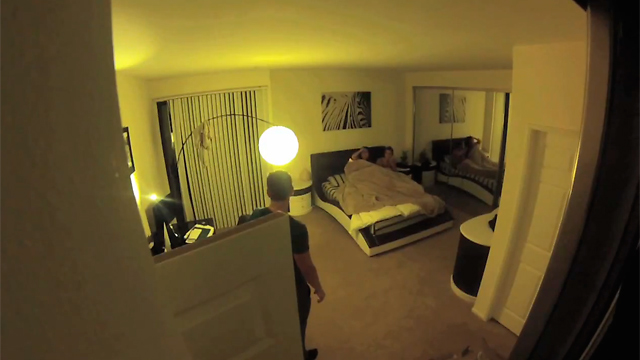
Where is `door`? This screenshot has width=640, height=360. door is located at coordinates (237, 309), (537, 231).